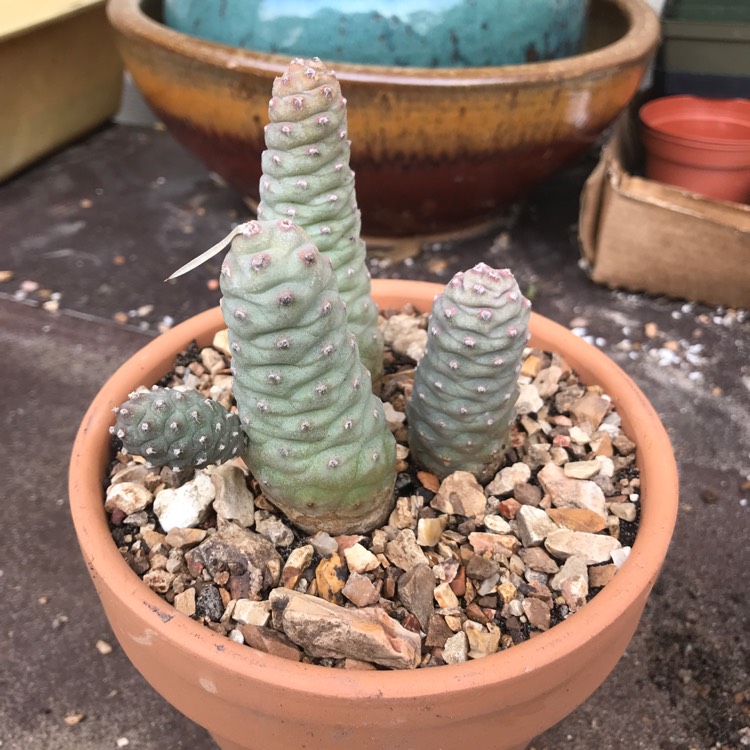
Locate an element on the screen. This screenshot has height=750, width=750. small planting containers is located at coordinates (724, 151), (709, 139).